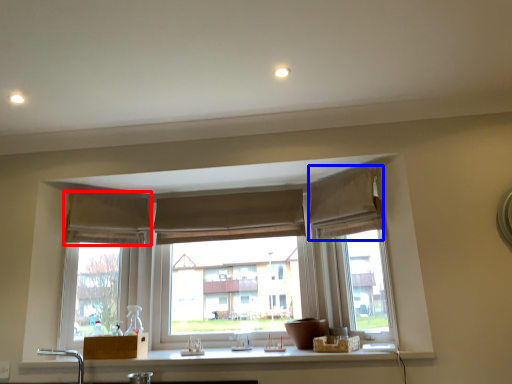
Question: Among these objects, which one is farthest to the camera, curtain (highlighted by a red box) or curtain (highlighted by a blue box)?

Choices:
 (A) curtain
 (B) curtain

Answer: (A)